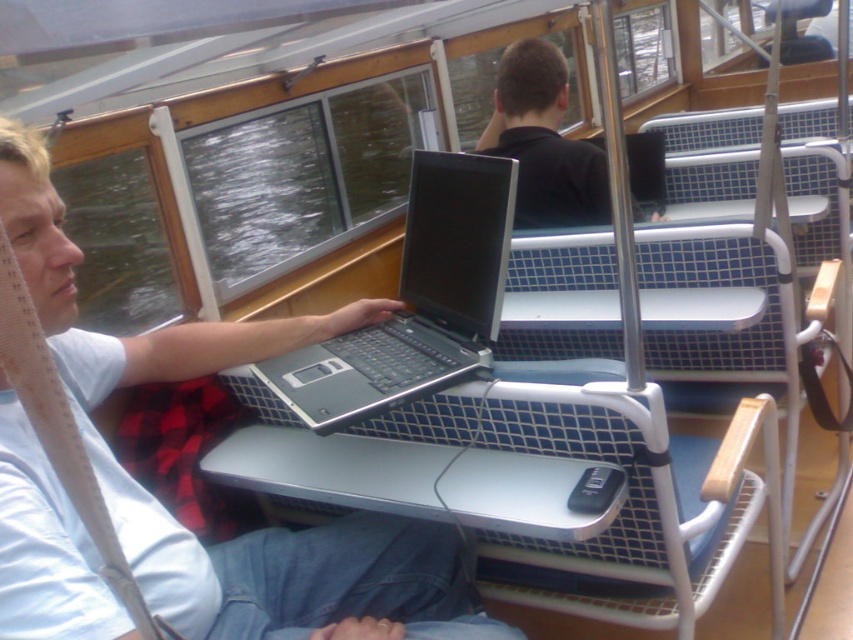
Question: Where is silver/black laptop at center located in relation to black matte shirt at upper center in the image?

Choices:
 (A) left
 (B) right

Answer: (A)

Question: Is silver/black laptop at center wider than black matte shirt at upper center?

Choices:
 (A) yes
 (B) no

Answer: (A)

Question: Does silver/black laptop at center have a smaller size compared to black matte shirt at upper center?

Choices:
 (A) yes
 (B) no

Answer: (A)

Question: Among these points, which one is farthest from the camera?

Choices:
 (A) (515, 104)
 (B) (405, 294)

Answer: (A)